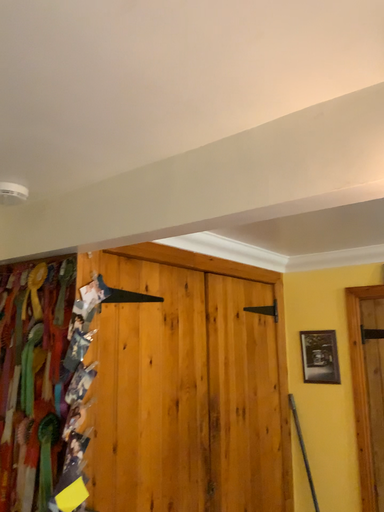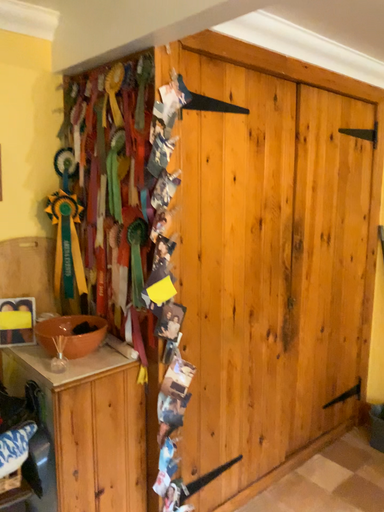
Question: Which way did the camera rotate in the video?

Choices:
 (A) rotated downward
 (B) rotated upward

Answer: (A)